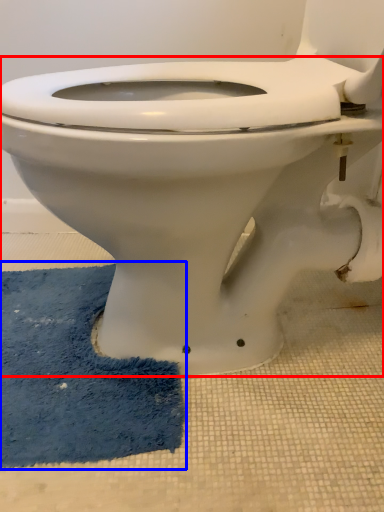
Question: Which of the following is the farthest to the observer, toilet (highlighted by a red box) or bath mat (highlighted by a blue box)?

Choices:
 (A) toilet
 (B) bath mat

Answer: (B)